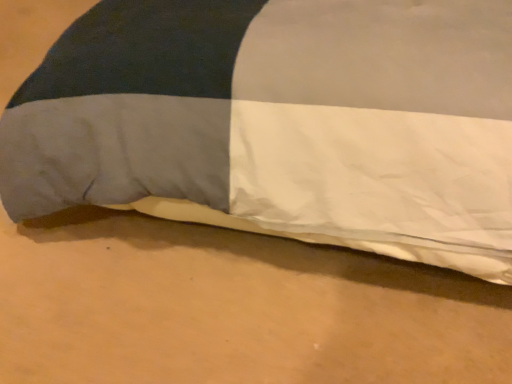
Image resolution: width=512 pixels, height=384 pixels. In order to click on white fabric pillow at center in this screenshot , I will do `click(282, 123)`.

What is the approximate height of white fabric pillow at center?

It is 2.03 inches.

Describe the element at coordinates (282, 123) in the screenshot. I see `white fabric pillow at center` at that location.

This screenshot has width=512, height=384. I want to click on white fabric pillow at center, so click(282, 123).